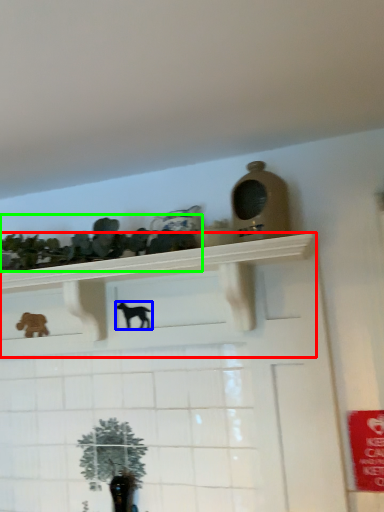
Question: Which is nearer to the shelf (highlighted by a red box)? animal (highlighted by a blue box) or collection (highlighted by a green box).

Choices:
 (A) animal
 (B) collection

Answer: (B)